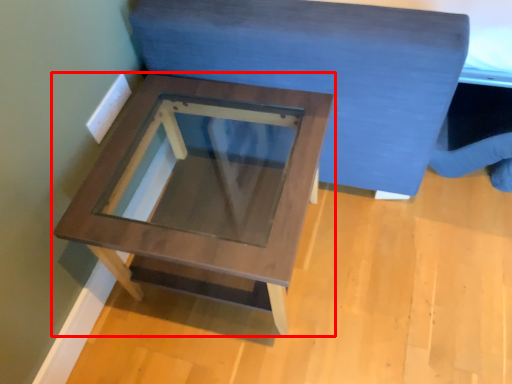
Question: Considering the relative positions of table (annotated by the red box) and bedding in the image provided, where is table (annotated by the red box) located with respect to the staircase?

Choices:
 (A) right
 (B) left

Answer: (B)